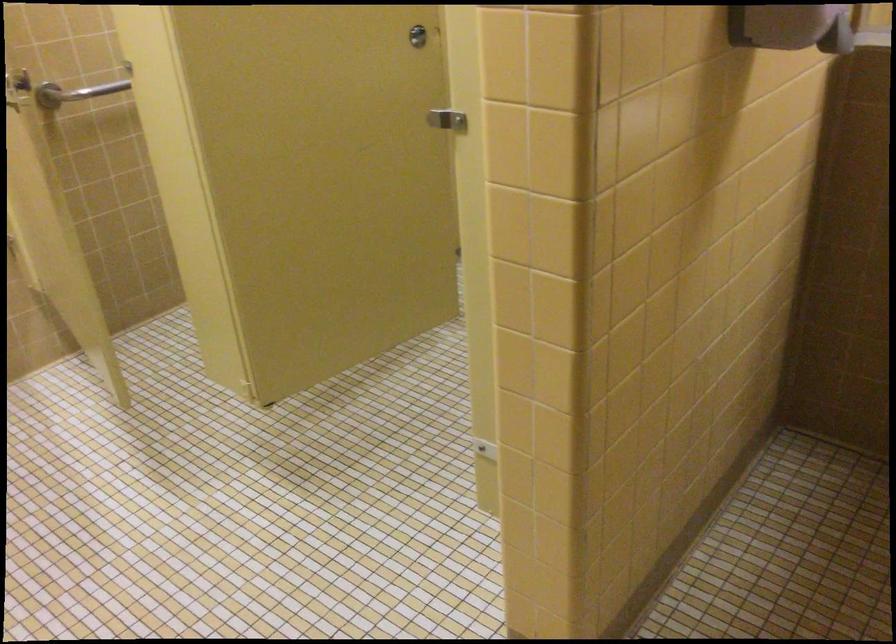
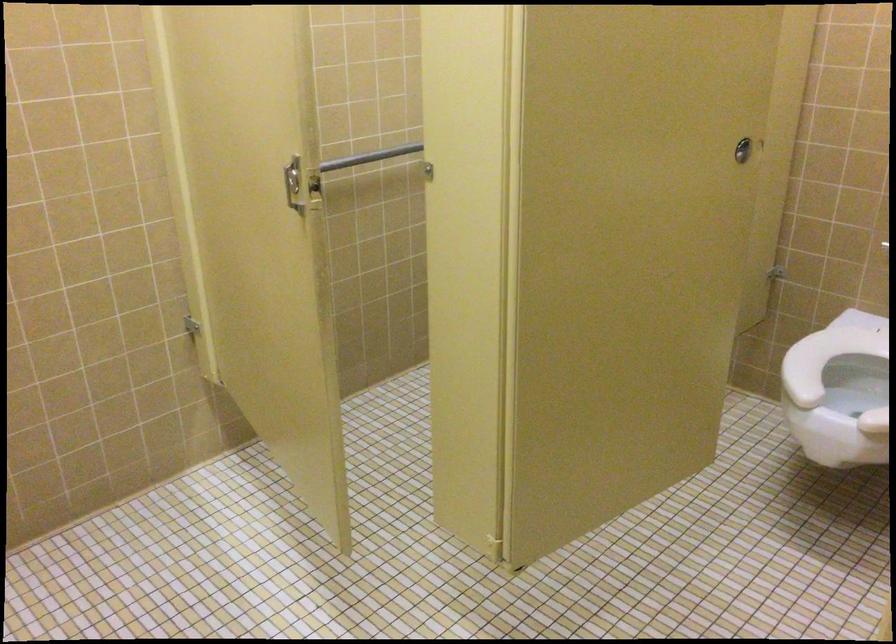
Question: Based on the continuous images, in which direction is the camera rotating? Reply with the corresponding letter.

Choices:
 (A) Left
 (B) Right
 (C) Up
 (D) Down

Answer: (C)